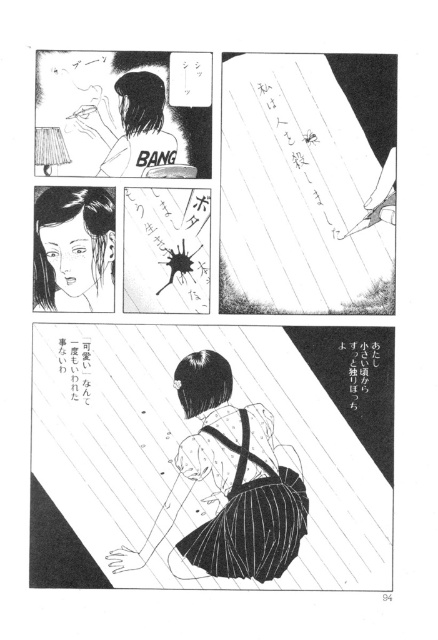
What are the coordinates of the smooth black hair at center in the top right panel?

The smooth black hair at center is located at coordinates point (74, 250).

In the manga panel where you see the black striped skirt at center and the smooth black hair at center, which object occupies more vertical space?

The black striped skirt at center has a greater height compared to the smooth black hair at center, so it occupies more vertical space.

Looking at the top right panel of the manga page, you see the smooth black hair at center and the black paper at lower left. Which object is positioned to the left?

The smooth black hair at center is to the left of the black paper at lower left.